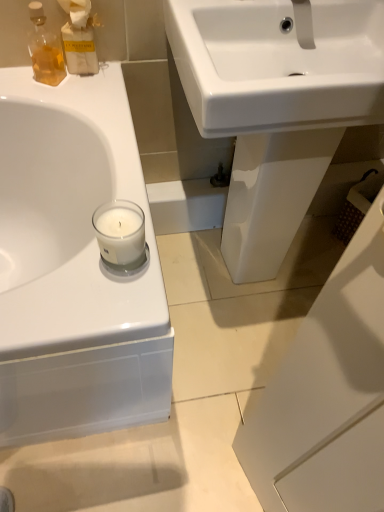
What do you see at coordinates (121, 234) in the screenshot? This screenshot has width=384, height=512. I see `clear glass candle at left` at bounding box center [121, 234].

I want to click on translucent amber glass bottle at upper left, so click(x=44, y=49).

Is matte glass bottle at upper left surrounding white glossy sink at center?

No, white glossy sink at center is not surrounded by matte glass bottle at upper left.

Which is behind, point (77, 1) or point (295, 142)?

The point (295, 142) is behind.

Can you confirm if matte glass bottle at upper left is thinner than white glossy sink at center?

Yes, matte glass bottle at upper left is thinner than white glossy sink at center.

Between matte glass bottle at upper left and white glossy sink at center, which one appears on the left side from the viewer's perspective?

Positioned to the left is matte glass bottle at upper left.

How much distance is there between white glossy sink at center and matte glass bottle at upper left?

white glossy sink at center and matte glass bottle at upper left are 47.89 centimeters apart.

Does white glossy sink at center touch matte glass bottle at upper left?

No.

From the image's perspective, is white glossy sink at center above matte glass bottle at upper left?

No, from the image's perspective, white glossy sink at center is not on top of matte glass bottle at upper left.

Between white glossy sink at center and matte glass bottle at upper left, which one has larger size?

white glossy sink at center is bigger.

Is point (109, 247) behind point (31, 53)?

That is False.

At what (x,y) coordinates should I click in order to perform the action: click on toiletry above the clear glass candle at left (from a real-world perspective). Please return your answer as a coordinate pair (x, y). The height and width of the screenshot is (512, 384). Looking at the image, I should click on (44, 49).

Based on their positions, is clear glass candle at left located to the left or right of translucent amber glass bottle at upper left?

clear glass candle at left is to the right of translucent amber glass bottle at upper left.

Is clear glass candle at left located outside translucent amber glass bottle at upper left?

That's correct, clear glass candle at left is outside of translucent amber glass bottle at upper left.

This screenshot has height=512, width=384. I want to click on candle holder in front of the translucent amber glass bottle at upper left, so click(x=121, y=234).

Is there a large distance between translucent amber glass bottle at upper left and clear glass candle at left?

No, translucent amber glass bottle at upper left is not far away from clear glass candle at left.

From the picture: Is translucent amber glass bottle at upper left taller or shorter than clear glass candle at left?

translucent amber glass bottle at upper left is taller than clear glass candle at left.

Does translucent amber glass bottle at upper left have a lesser width compared to clear glass candle at left?

Correct, the width of translucent amber glass bottle at upper left is less than that of clear glass candle at left.

Is matte glass bottle at upper left situated inside clear glass candle at left or outside?

matte glass bottle at upper left cannot be found inside clear glass candle at left.

The width and height of the screenshot is (384, 512). In order to click on cleaning product on the left of clear glass candle at left in this screenshot , I will do `click(79, 38)`.

From the image's perspective, between matte glass bottle at upper left and clear glass candle at left, who is located below?

clear glass candle at left appears lower in the image.

From a real-world perspective, is matte glass bottle at upper left beneath clear glass candle at left?

Actually, matte glass bottle at upper left is physically above clear glass candle at left in the real world.

Consider the image. Considering the relative sizes of clear glass candle at left and matte glass bottle at upper left in the image provided, is clear glass candle at left smaller than matte glass bottle at upper left?

Yes.

Looking at this image, considering the sizes of clear glass candle at left and matte glass bottle at upper left in the image, is clear glass candle at left wider or thinner than matte glass bottle at upper left?

clear glass candle at left is wider than matte glass bottle at upper left.

There is a clear glass candle at left. At what (x,y) coordinates should I click in order to perform the action: click on cleaning product above it (from a real-world perspective). Please return your answer as a coordinate pair (x, y). This screenshot has height=512, width=384. Looking at the image, I should click on (79, 38).

Who is more distant, clear glass candle at left or matte glass bottle at upper left?

matte glass bottle at upper left is more distant.

From the picture: Considering the sizes of white glossy sink at center and translucent amber glass bottle at upper left in the image, is white glossy sink at center bigger or smaller than translucent amber glass bottle at upper left?

Considering their sizes, white glossy sink at center takes up more space than translucent amber glass bottle at upper left.

Is translucent amber glass bottle at upper left at the back of white glossy sink at center?

No, white glossy sink at center is not facing the opposite direction of translucent amber glass bottle at upper left.

Is white glossy sink at center directly adjacent to translucent amber glass bottle at upper left?

No, white glossy sink at center is not making contact with translucent amber glass bottle at upper left.

Identify the location of cleaning product above the white glossy sink at center (from a real-world perspective). Image resolution: width=384 pixels, height=512 pixels. (79, 38).

Image resolution: width=384 pixels, height=512 pixels. I want to click on sink directly beneath the matte glass bottle at upper left (from a real-world perspective), so click(x=276, y=105).

Looking at this image, based on their spatial positions, is translucent amber glass bottle at upper left or white glossy sink at center closer to clear glass candle at left?

Based on the image, white glossy sink at center appears to be nearer to clear glass candle at left.

From the image, which object appears to be nearer to white glossy sink at center, clear glass candle at left or matte glass bottle at upper left?

Based on the image, clear glass candle at left appears to be nearer to white glossy sink at center.

From the image, which object appears to be nearer to matte glass bottle at upper left, white glossy sink at center or clear glass candle at left?

white glossy sink at center lies closer to matte glass bottle at upper left than the other object.

In the scene shown: Based on their spatial positions, is matte glass bottle at upper left or translucent amber glass bottle at upper left further from clear glass candle at left?

translucent amber glass bottle at upper left.

Looking at the image, which one is located further to matte glass bottle at upper left, white glossy sink at center or translucent amber glass bottle at upper left?

Among the two, white glossy sink at center is located further to matte glass bottle at upper left.

From the image, which object appears to be nearer to white glossy sink at center, translucent amber glass bottle at upper left or clear glass candle at left?

clear glass candle at left.

Looking at the image, which one is located closer to matte glass bottle at upper left, translucent amber glass bottle at upper left or clear glass candle at left?

translucent amber glass bottle at upper left is closer to matte glass bottle at upper left.

Based on their spatial positions, is translucent amber glass bottle at upper left or matte glass bottle at upper left closer to white glossy sink at center?

The object closer to white glossy sink at center is matte glass bottle at upper left.

The height and width of the screenshot is (512, 384). What are the coordinates of `toiletry between matte glass bottle at upper left and clear glass candle at left in the up-down direction` in the screenshot? It's located at (44, 49).

Identify the location of candle holder between translucent amber glass bottle at upper left and white glossy sink at center in the horizontal direction. This screenshot has width=384, height=512. (121, 234).

You are a GUI agent. You are given a task and a screenshot of the screen. Output one action in this format:
    pyautogui.click(x=<x>, y=<y>)
    Task: Click on the cleaning product located between translucent amber glass bottle at upper left and white glossy sink at center in the left-right direction
    
    Given the screenshot: What is the action you would take?
    pyautogui.click(x=79, y=38)

The height and width of the screenshot is (512, 384). I want to click on candle holder located between matte glass bottle at upper left and white glossy sink at center in the left-right direction, so click(121, 234).